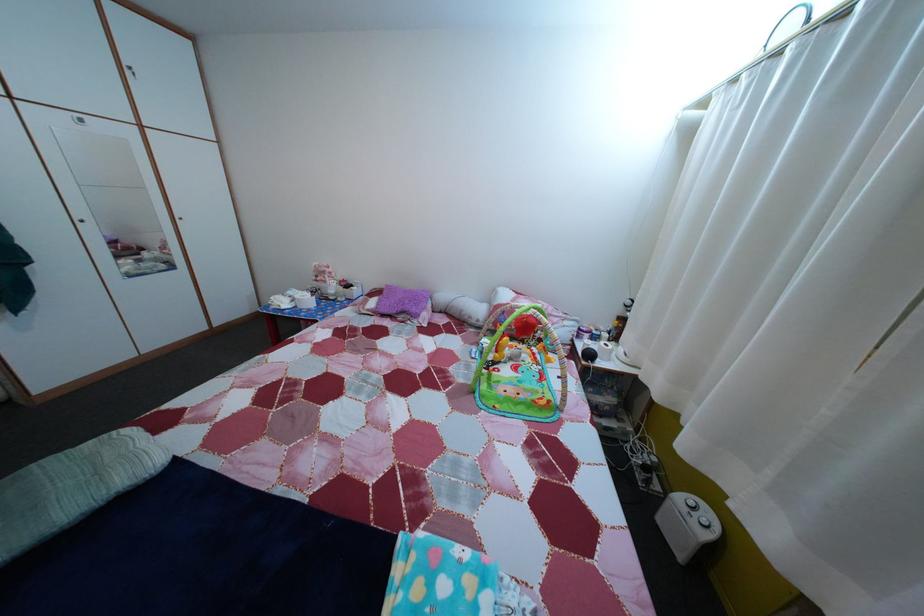
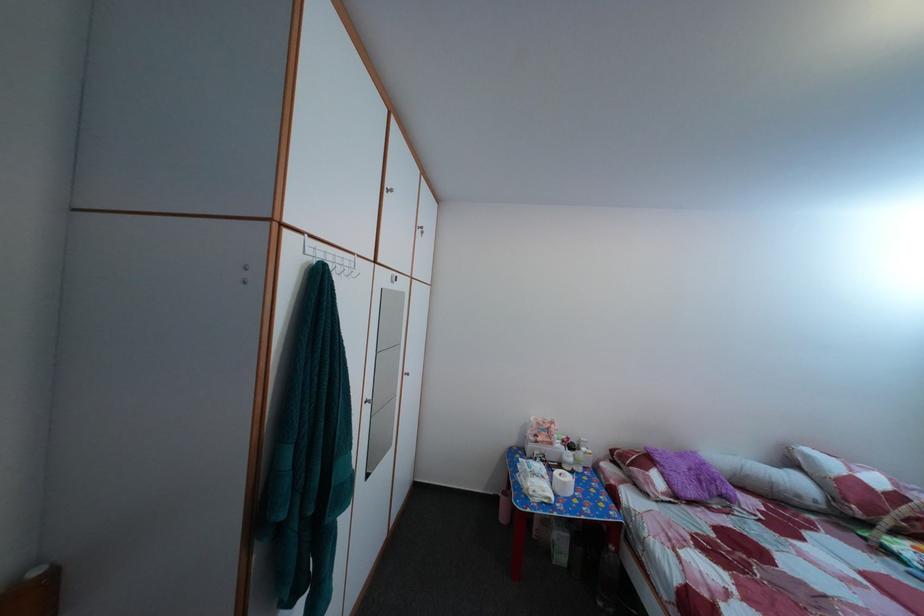
In the second image, find the point that corresponds to the point at 354,288 in the first image.

(578, 447)